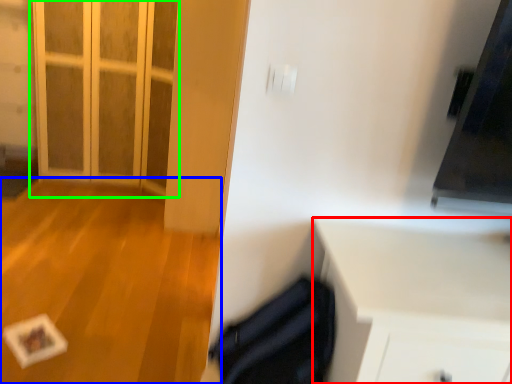
Question: Which is farther away from cabinetry (highlighted by a red box)? plain (highlighted by a blue box) or door (highlighted by a green box)?

Choices:
 (A) plain
 (B) door

Answer: (B)